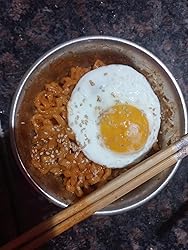
This screenshot has height=250, width=188. I want to click on bowl, so click(x=114, y=210).